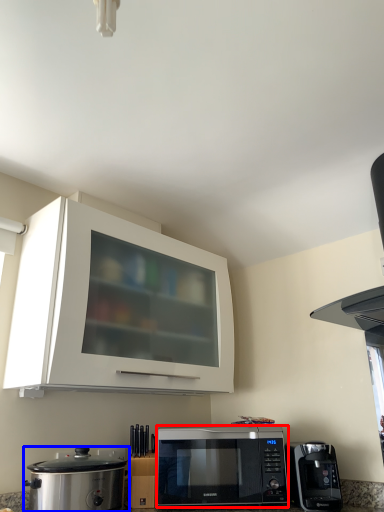
Question: Among these objects, which one is nearest to the camera, microwave oven (highlighted by a red box) or home appliance (highlighted by a blue box)?

Choices:
 (A) microwave oven
 (B) home appliance

Answer: (B)